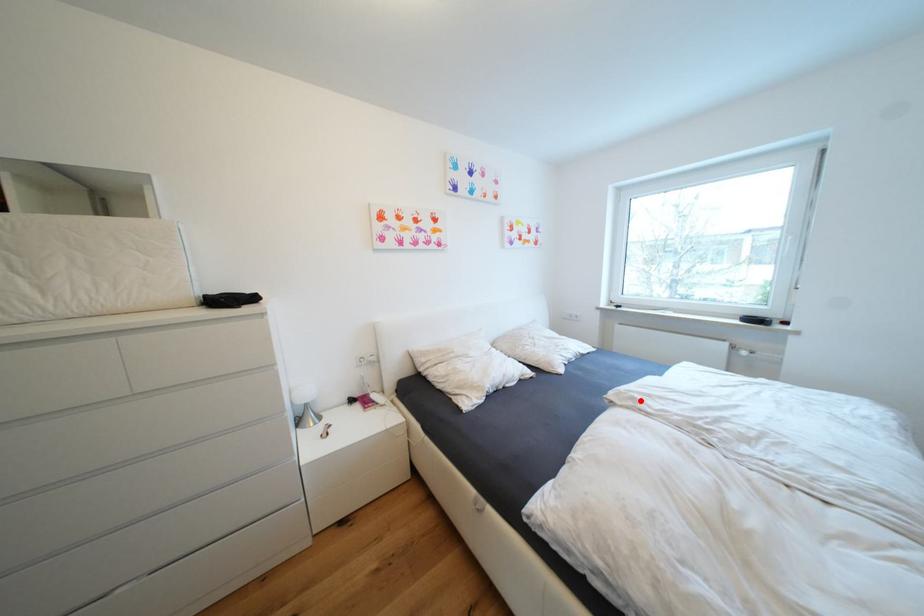
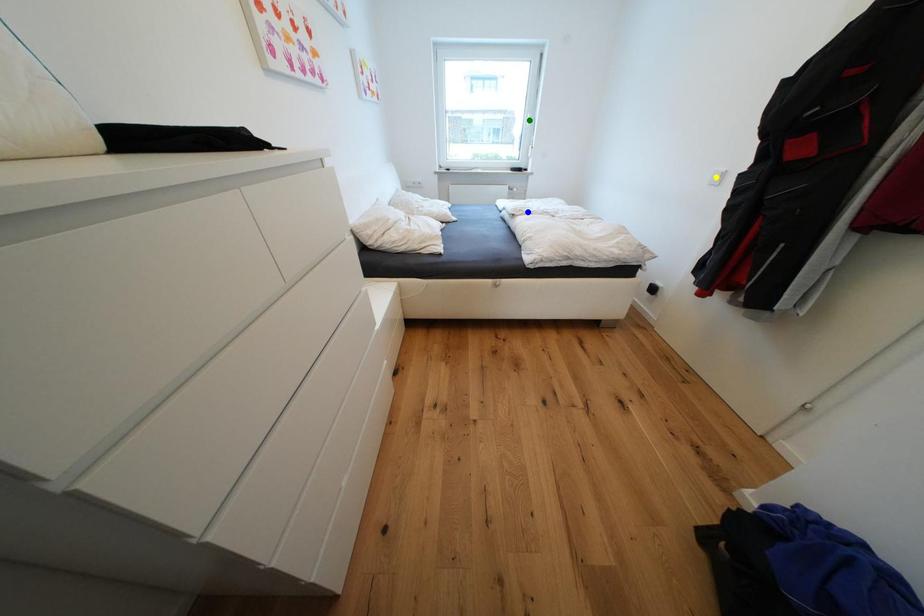
Question: I am providing you with two images of the same scene from different viewpoints. A red point is marked on the first image. You are given multiple points on the second image. Which point in image 2 represents the same 3d spot as the red point in image 1?

Choices:
 (A) green point
 (B) yellow point
 (C) blue point

Answer: (C)